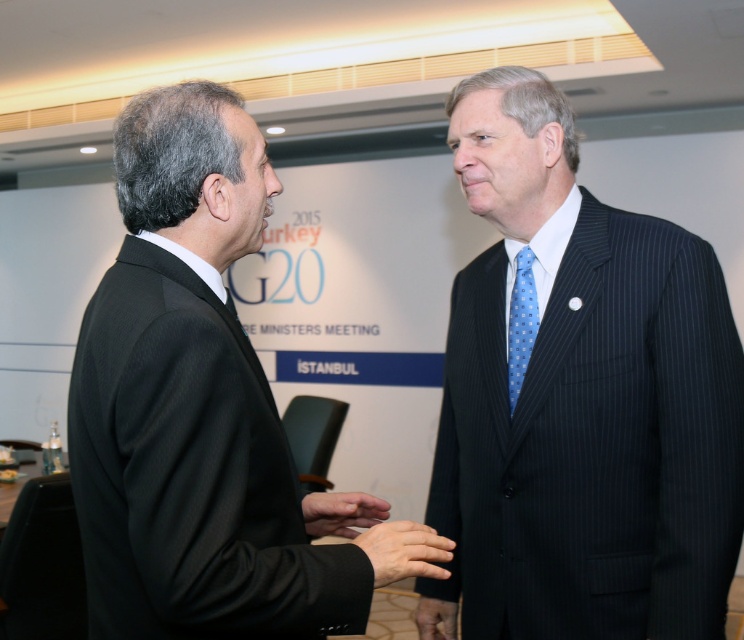
You are a photographer at the event and need to frame a closeup shot focusing on both the smooth skin hand at center and the blue dotted tie at right. Based on their sizes, which object should you adjust your camera focus to prioritize in terms of visibility?

The smooth skin hand at center is not as tall as the blue dotted tie at right, so you should prioritize focusing on the blue dotted tie at right to ensure it remains visible in the closeup shot.

You are organizing a formal event and need to ensure that the seating arrangement accommodates the width of the black pinstripe suit at left and the blue dotted tie at right. Which object requires more space in terms of width?

The black pinstripe suit at left requires more space in terms of width because its width is larger than that of the blue dotted tie at right.

You are a photographer at the event and need to capture a closeup shot of the dark blue pinstripe suit at right and the smooth skin hand at center. Which object is wider when viewed from your camera lens?

The dark blue pinstripe suit at right is wider than the smooth skin hand at center.